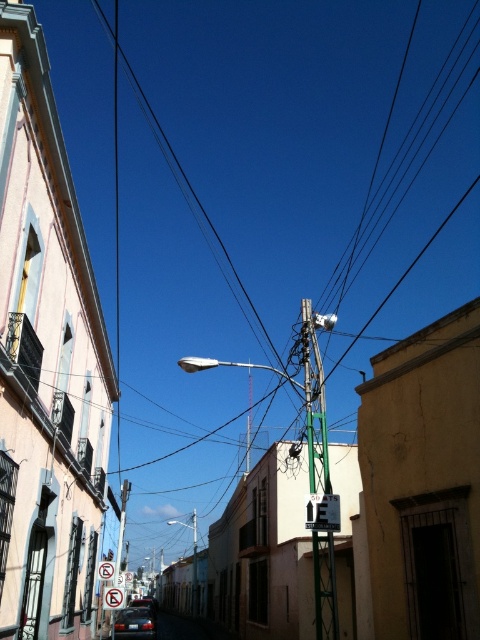
You are a delivery drone that needs to fly through the space between the shiny red car at center and the metallic rectangular sign at center. The drone has a height of 1.2 meters. Can it safely pass through without hitting either object?

The shiny red car at center is taller than the metallic rectangular sign at center. Since the drone is 1.2 meters tall, it can safely pass through the space between them as long as the shorter object, the metallic rectangular sign at center, allows enough vertical clearance. However, the exact height of the sign isn

You are a pedestrian standing on the narrow street looking up. You see a white plastic street sign at center and a shiny red car at center. Which object is closer to you?

The white plastic street sign at center is closer to you because it is in front of the shiny red car at center.